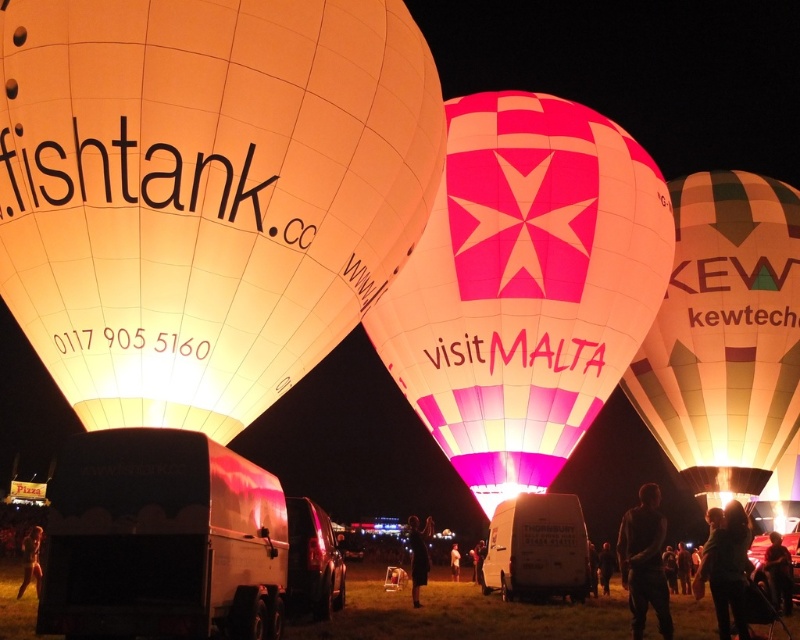
In the scene shown: You are standing in the field and see the yellow striped fabric hot air balloon at right and the dark hair at lower right. Which object is located further to the east?

The yellow striped fabric hot air balloon at right is located to the right of dark hair at lower right, so it is further to the east.

You are a photographer standing at the lower right corner of the image. You notice the yellow striped fabric hot air balloon at right and the dark hair at lower right. Which object is closer to your current position?

The dark hair at lower right is closer to your current position because it is located at the lower right corner, while the yellow striped fabric hot air balloon at right is positioned over it, indicating it is further away.

You are a photographer standing in the scene. You need to capture a photo where both the dark hair at lower right and the dark clothing at center are visible. Considering their sizes, which object should you zoom in on to ensure both fit in the frame?

Since the dark hair at lower right is narrower than the dark clothing at center, you should zoom in on the dark clothing at center to ensure both fit in the frame.